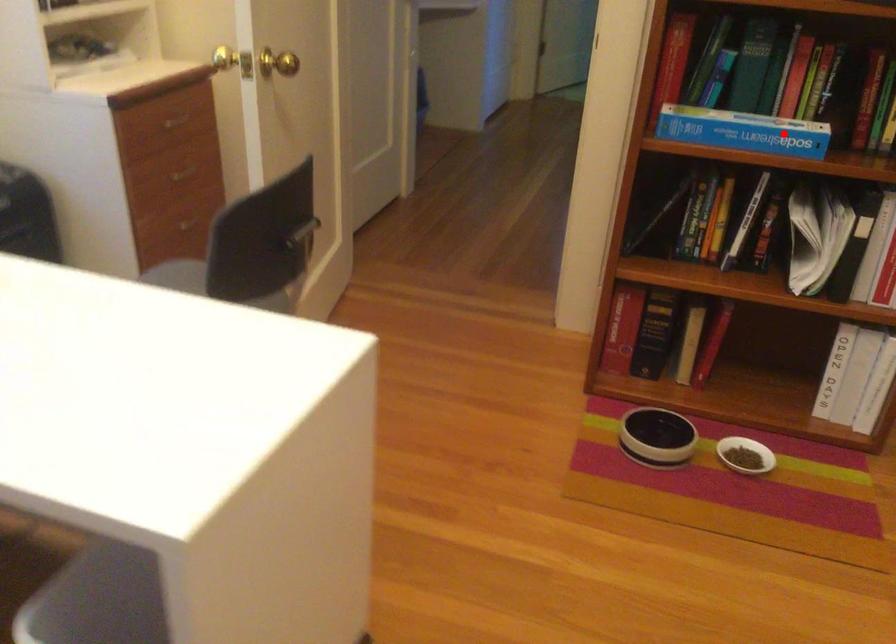
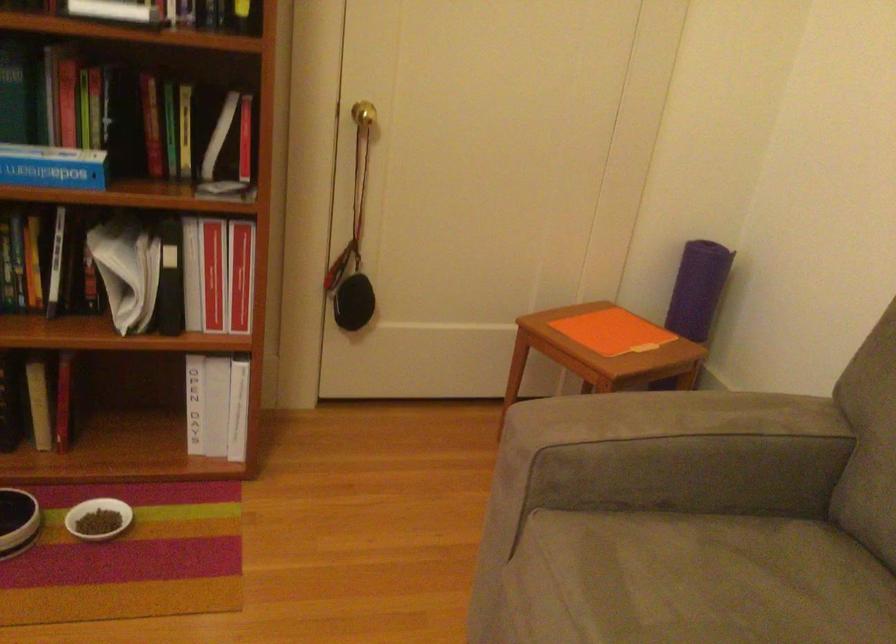
Question: I am providing you with two images of the same scene from different viewpoints. Given a red point in image1, look at the same physical point in image2. Is it:

Choices:
 (A) Closer to the viewpoint
 (B) Farther from the viewpoint

Answer: (A)